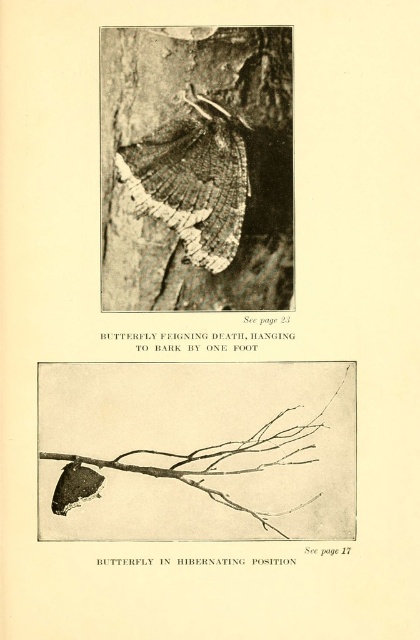
You are an entomologist examining the bottom photograph. You need to determine which object is smaller between the brown textured branch at lower left and the smooth bark tree trunk at center. Which one is it?

The brown textured branch at lower left is smaller than the smooth bark tree trunk at center.

You are a nature photographer analyzing the bottom photograph. You notice the brown textured branch at lower left and the smooth bark tree trunk at center. Which object is positioned to the right side of the other?

The brown textured branch at lower left is to the right of smooth bark tree trunk at center.